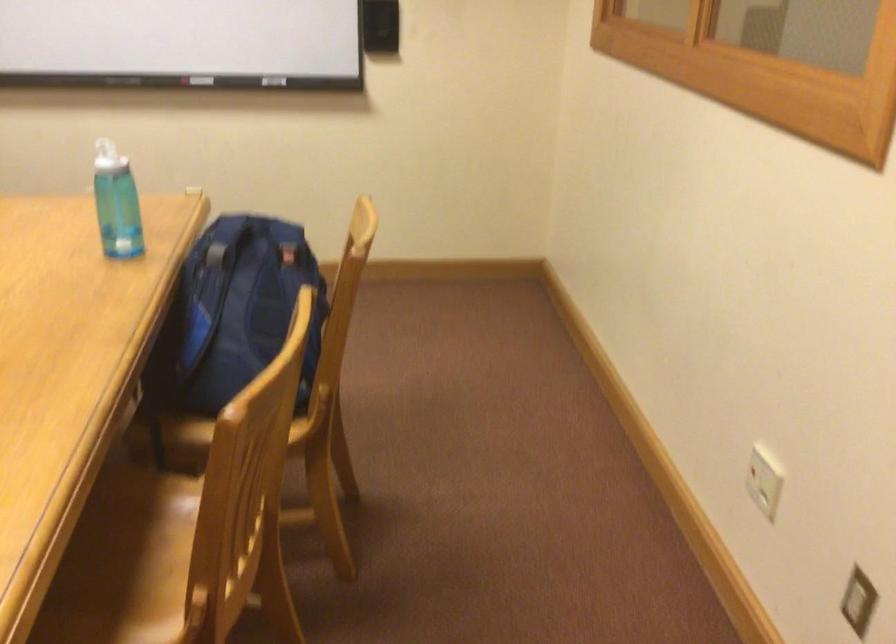
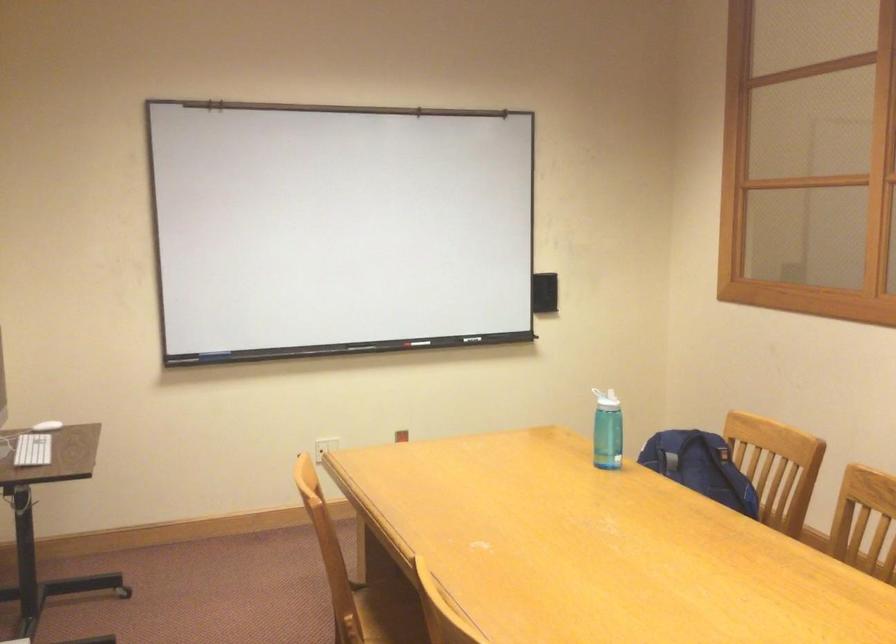
The point at (273, 86) is marked in the first image. Where is the corresponding point in the second image?

(476, 339)